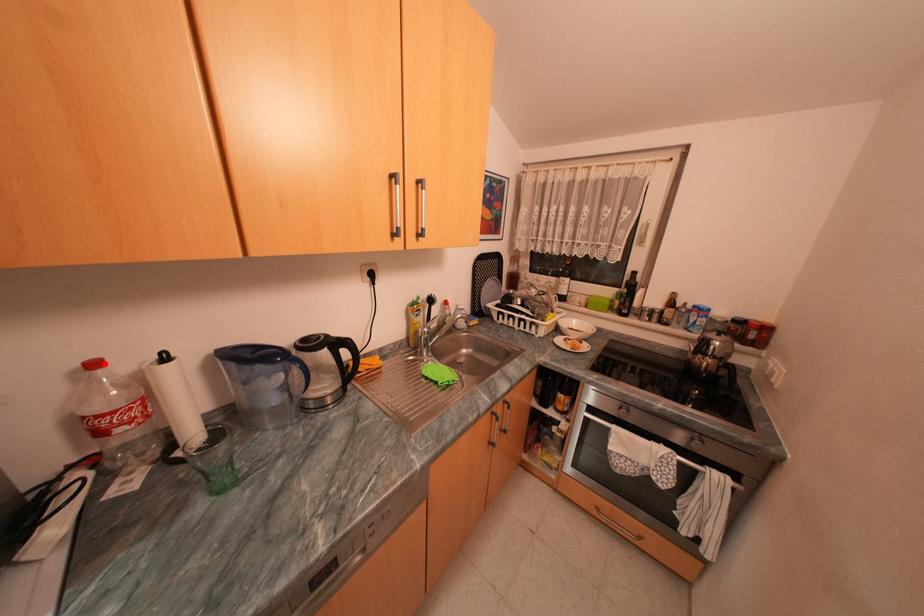
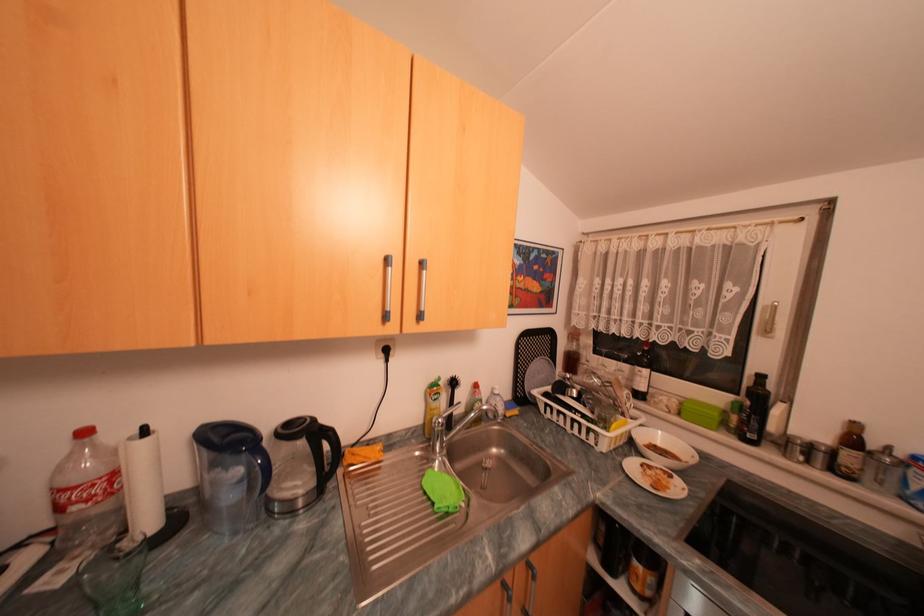
Locate, in the second image, the point that corresponds to the highlighted location in the first image.

(94, 432)